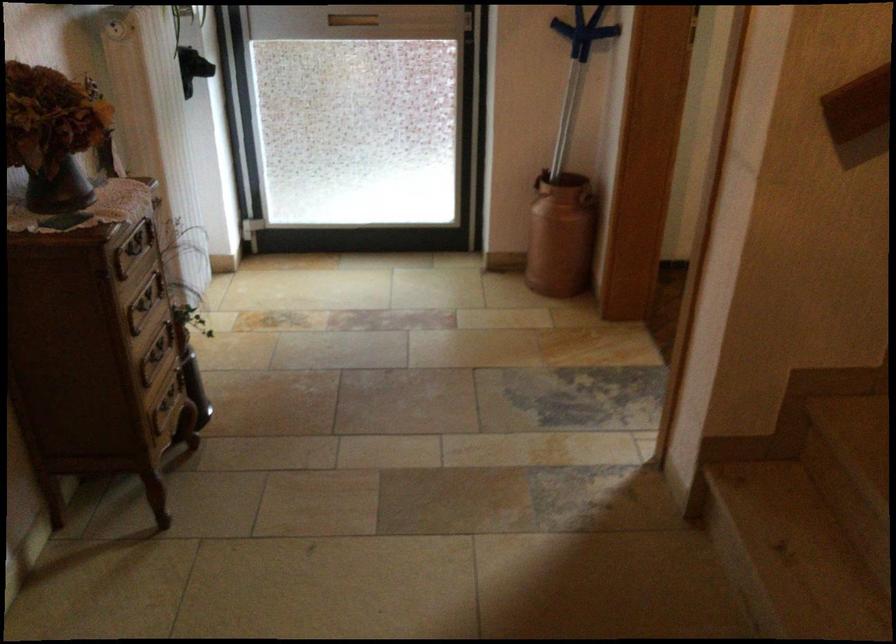
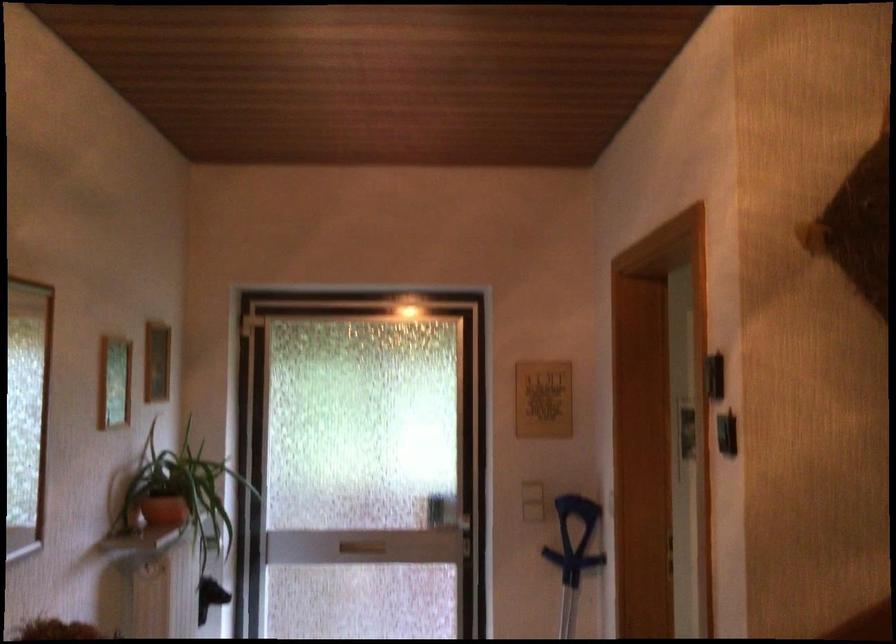
Question: How did the camera likely rotate?

Choices:
 (A) Left
 (B) Right
 (C) Up
 (D) Down

Answer: (C)